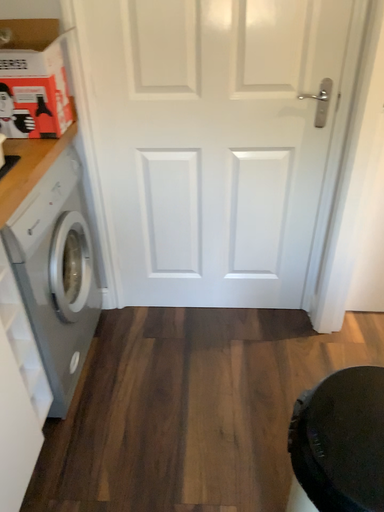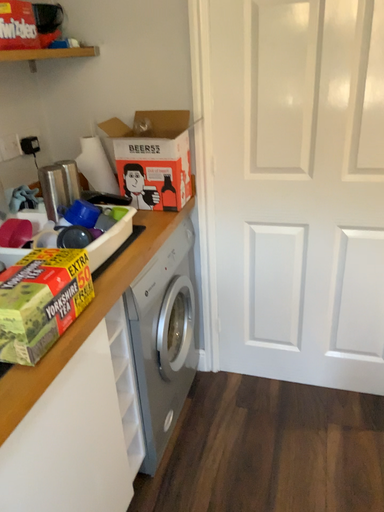
Question: How did the camera likely rotate when shooting the video?

Choices:
 (A) rotated left
 (B) rotated right

Answer: (A)